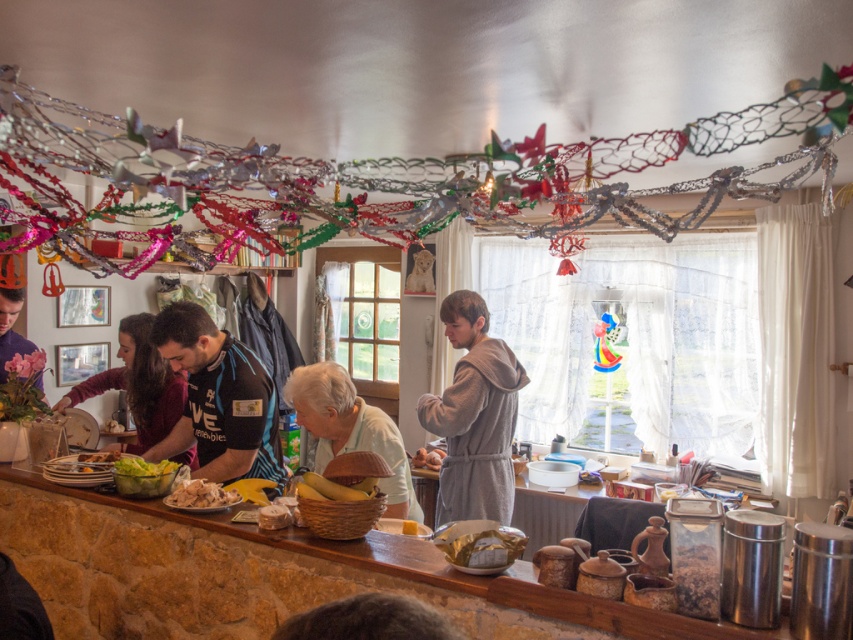
Which is more to the left, green leafy salad at center or white crumbly bread at lower center?

green leafy salad at center is more to the left.

Can you confirm if green leafy salad at center is positioned to the left of white crumbly bread at lower center?

Indeed, green leafy salad at center is positioned on the left side of white crumbly bread at lower center.

Is point (119, 486) farther from viewer compared to point (225, 497)?

Yes, point (119, 486) is farther from viewer.

This screenshot has height=640, width=853. Find the location of `green leafy salad at center`. green leafy salad at center is located at coordinates (143, 476).

Does yellow matte bananas at center have a smaller size compared to brown matte eggs at center?

Yes.

From the picture: Who is higher up, yellow matte bananas at center or brown matte eggs at center?

yellow matte bananas at center is higher up.

Does point (309, 477) lie behind point (415, 464)?

No, (309, 477) is closer to viewer.

Identify the location of yellow matte bananas at center. coord(332,486).

How far apart are matte black laptop at left and white crumbly bread at lower center?

The distance of matte black laptop at left from white crumbly bread at lower center is 5.80 feet.

Is point (19, 292) positioned after point (202, 506)?

Yes, it is.

Between point (6, 317) and point (221, 490), which one is positioned in front?

Positioned in front is point (221, 490).

At what (x,y) coordinates should I click in order to perform the action: click on matte black laptop at left. Please return your answer as a coordinate pair (x, y). Image resolution: width=853 pixels, height=640 pixels. Looking at the image, I should click on (10, 326).